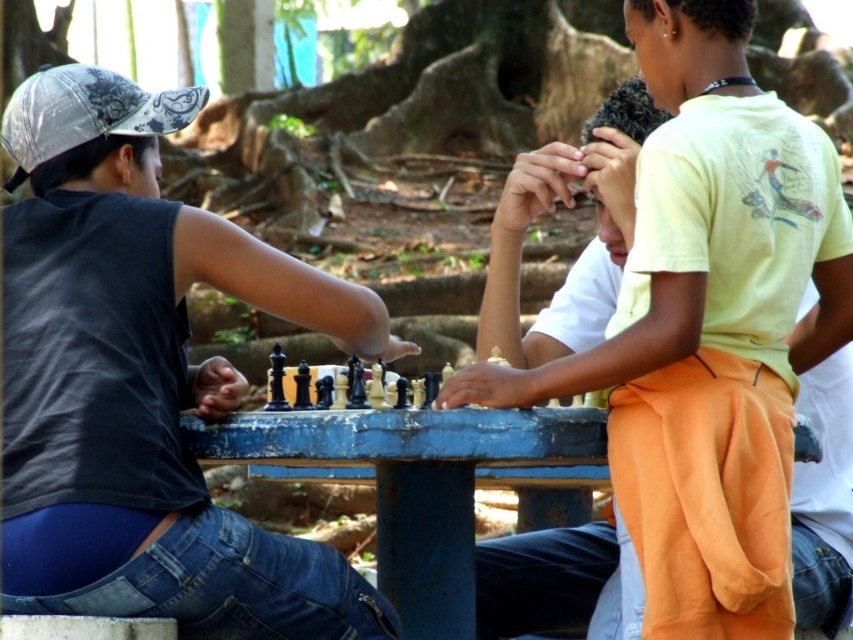
Is point (120, 76) positioned behind point (601, 536)?

No.

Between point (84, 211) and point (479, 547), which one is positioned behind?

The point (479, 547) is behind.

Is point (157, 332) positioned behind point (646, 93)?

No.

This screenshot has height=640, width=853. I want to click on matte black chess set at center, so click(144, 381).